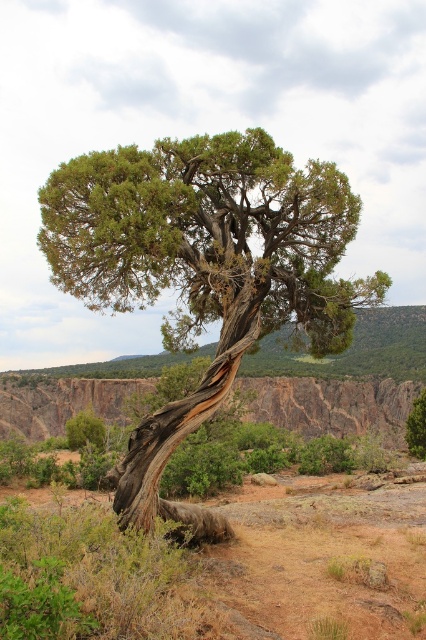
Is green textured tree at center thinner than rusty rock cliff at center?

Yes.

Which is behind, point (203, 305) or point (336, 412)?

The point (336, 412) is more distant.

Image resolution: width=426 pixels, height=640 pixels. What do you see at coordinates (204, 269) in the screenshot? I see `green textured tree at center` at bounding box center [204, 269].

At what (x,y) coordinates should I click in order to perform the action: click on green textured tree at center. Please return your answer as a coordinate pair (x, y). This screenshot has height=640, width=426. Looking at the image, I should click on pyautogui.click(x=204, y=269).